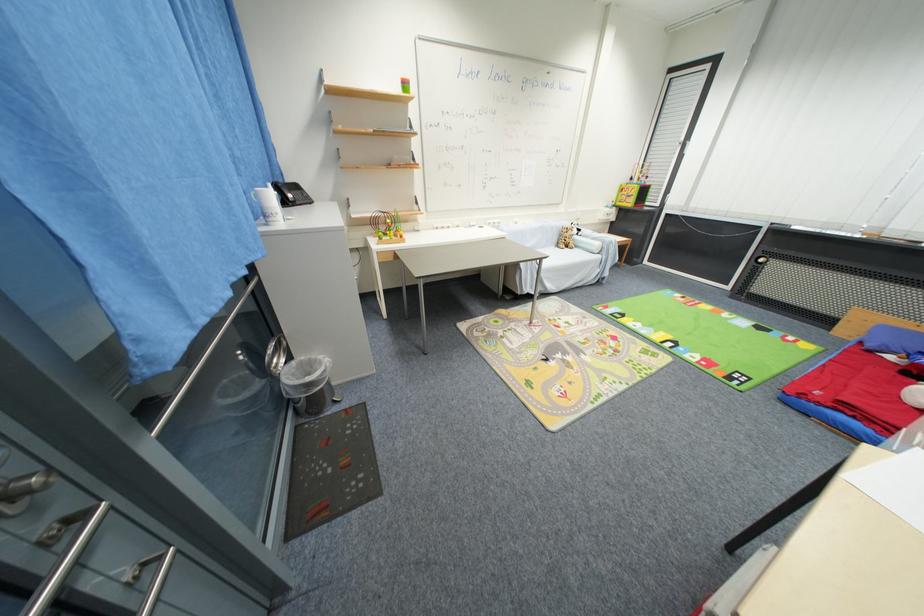
Which object does [386,227] point to?

It refers to a bead maze toy.